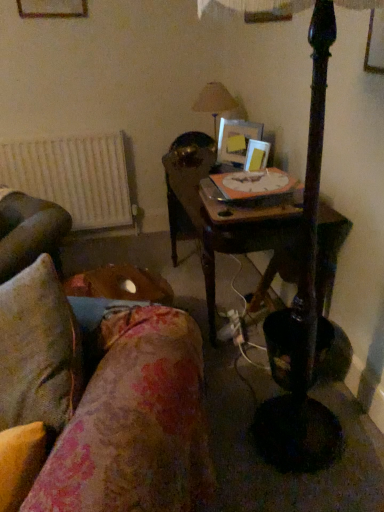
Question: Considering the positions of matte beige lampshade at upper center and wooden picture frame at center, which is counted as the 2th picture frame, starting from the top, in the image, is matte beige lampshade at upper center wider or thinner than wooden picture frame at center, which is counted as the 2th picture frame, starting from the top,?

Choices:
 (A) wide
 (B) thin

Answer: (A)

Question: Does point (210, 110) appear closer or farther from the camera than point (216, 148)?

Choices:
 (A) closer
 (B) farther

Answer: (B)

Question: Which object is the farthest from the white matte radiator at left?

Choices:
 (A) floral fabric couch at lower left
 (B) wooden table at center
 (C) matte wooden picture frame at upper center, arranged as the 1th picture frame when viewed from the right
 (D) wooden picture frame at upper left, positioned as the 1th picture frame in top-to-bottom order
 (E) wooden picture frame at center, the 2th picture frame positioned from the left

Answer: (A)

Question: Considering the real-world distances, which object is farthest from the wooden picture frame at upper left, positioned as the 1th picture frame in top-to-bottom order?

Choices:
 (A) matte wooden picture frame at upper center, arranged as the 1th picture frame when viewed from the right
 (B) white matte radiator at left
 (C) wooden table at center
 (D) floral fabric couch at lower left
 (E) matte beige lampshade at upper center

Answer: (D)